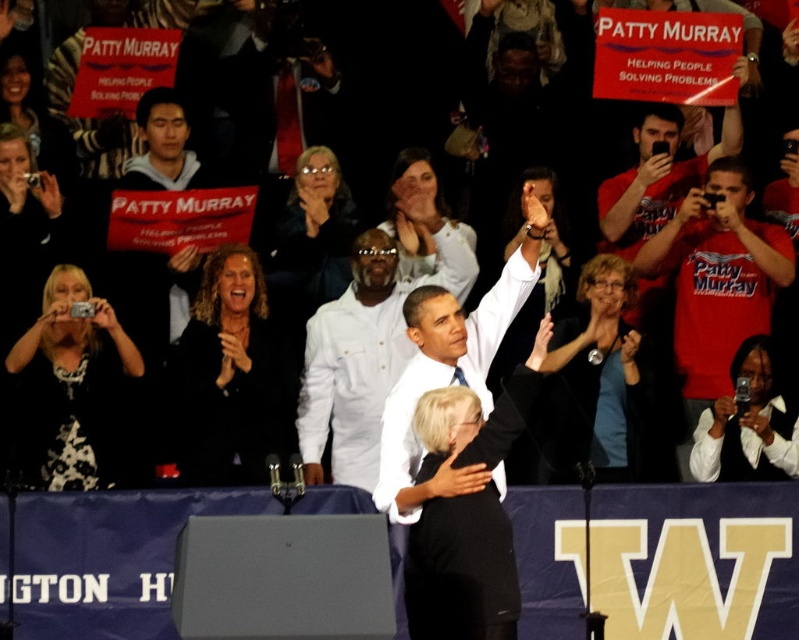
What is located at the coordinates point (364, 355)?

The white cotton shirt at center is located at point (364, 355).